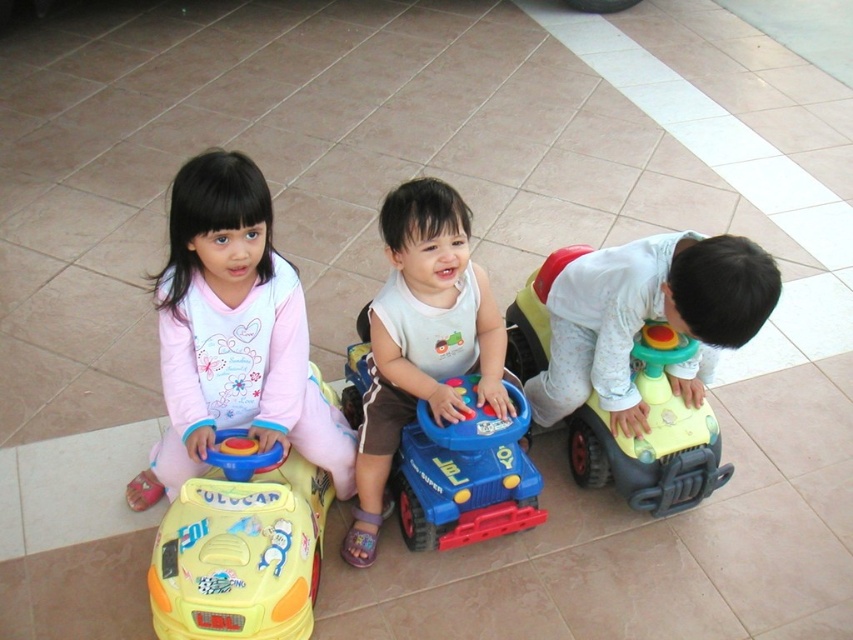
Who is positioned more to the right, pink matte/polyester dress at center or yellow plastic toy car at left?

yellow plastic toy car at left is more to the right.

At what (x,y) coordinates should I click in order to perform the action: click on pink matte/polyester dress at center. Please return your answer as a coordinate pair (x, y). The image size is (853, 640). Looking at the image, I should click on (233, 333).

Between point (370, 452) and point (595, 348), which one is positioned behind?

The point (595, 348) is behind.

Is matte blue toy car at center wider than matte white toy car at right?

In fact, matte blue toy car at center might be narrower than matte white toy car at right.

Is point (376, 356) in front of point (717, 300)?

No, it is behind (717, 300).

The height and width of the screenshot is (640, 853). I want to click on matte blue toy car at center, so click(x=422, y=339).

Is pink matte/polyester dress at center thinner than matte white toy car at right?

No, pink matte/polyester dress at center is not thinner than matte white toy car at right.

Between pink matte/polyester dress at center and matte white toy car at right, which one has less height?

Standing shorter between the two is matte white toy car at right.

The width and height of the screenshot is (853, 640). What do you see at coordinates (233, 333) in the screenshot?
I see `pink matte/polyester dress at center` at bounding box center [233, 333].

Where is `pink matte/polyester dress at center`? Image resolution: width=853 pixels, height=640 pixels. pink matte/polyester dress at center is located at coordinates (233, 333).